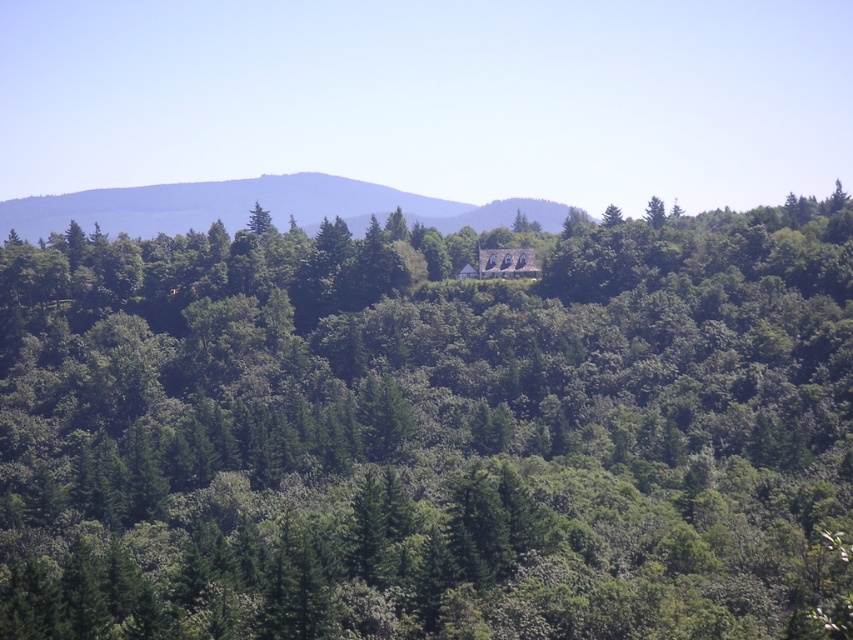
Can you confirm if green leafy tree at center is positioned below green leafy hillside at center?

Yes, green leafy tree at center is below green leafy hillside at center.

Does point (569, 397) lie in front of point (308, 212)?

Yes, point (569, 397) is closer to viewer.

The height and width of the screenshot is (640, 853). Find the location of `green leafy tree at center`. green leafy tree at center is located at coordinates (428, 428).